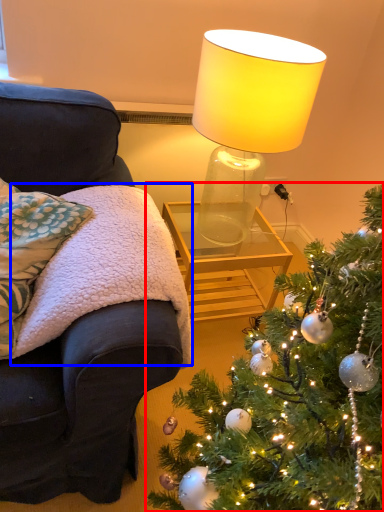
Question: Which of the following is the farthest to the observer, christmas tree (highlighted by a red box) or blanket (highlighted by a blue box)?

Choices:
 (A) christmas tree
 (B) blanket

Answer: (B)